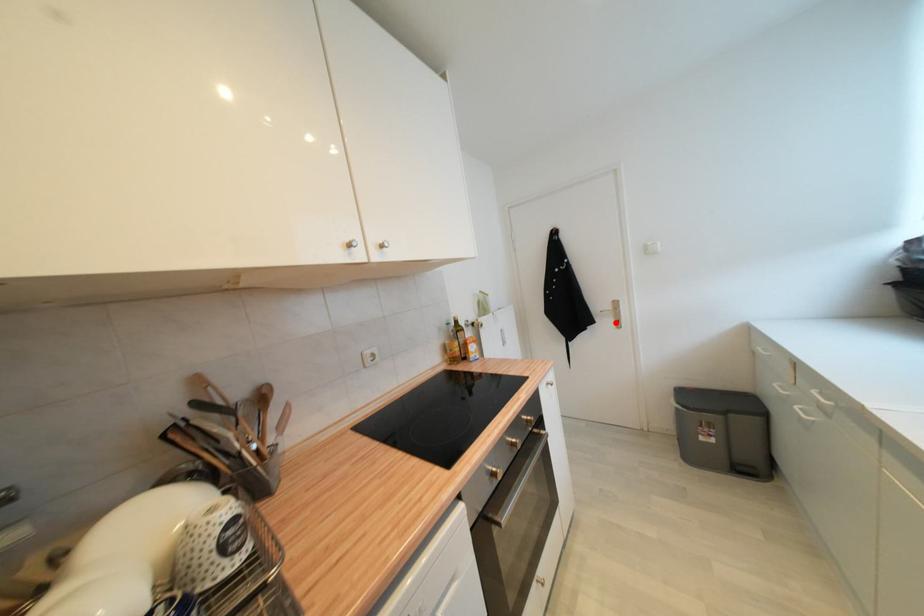
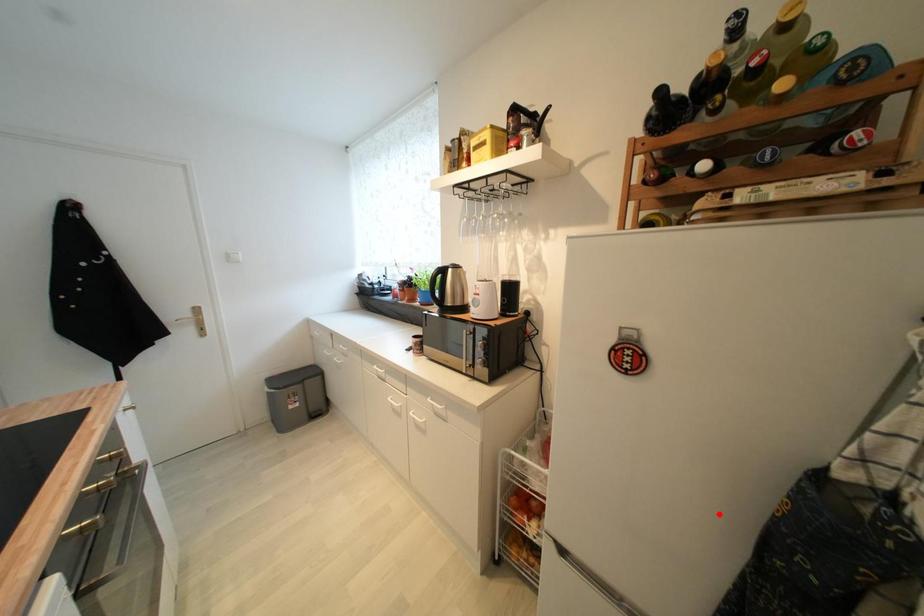
I am providing you with two images of the same scene from different viewpoints. A red point is marked on the first image and another point is marked on the second image. Does the point marked in image1 correspond to the same location as the one in image2?

No